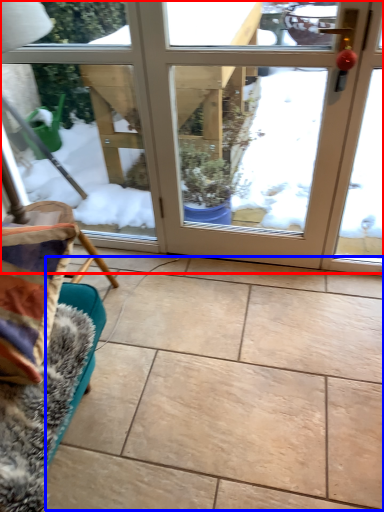
Question: Which object appears closest to the camera in this image, door (highlighted by a red box) or ceramic tile (highlighted by a blue box)?

Choices:
 (A) door
 (B) ceramic tile

Answer: (B)